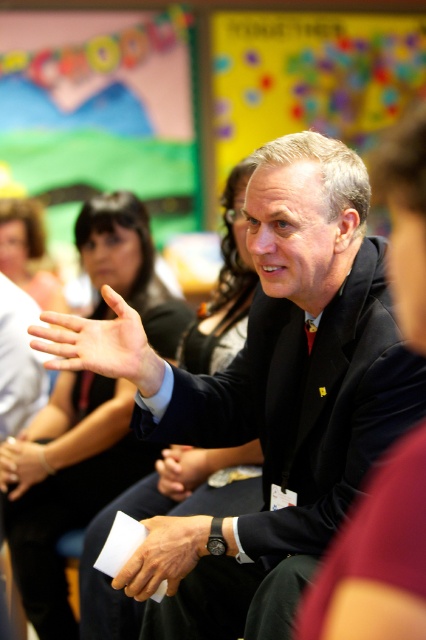
Based on the photo, you are standing in the classroom and want to reach the point marked at coordinates (287, 528). If you take a step forward of 1 meter, will you be closer to or farther from that point?

The point marked at coordinates (287, 528) is 1.38 meters away from you. Taking a step forward of 1 meter will bring you closer to the point, reducing the distance to 0.38 meters.

You are organizing a formal event and need to ensure that all attire and accessories are properly sized. Given the black matte suit at center and the matte black hand at center, which one has a greater width?

The black matte suit at center has a greater width than the matte black hand at center, as stated in the description.

You are an attendee at this event and need to locate the black matte suit at center and the white paper at center. According to the scene, which object is positioned higher?

The black matte suit at center is located above the white paper at center, so the black matte suit at center is positioned higher.